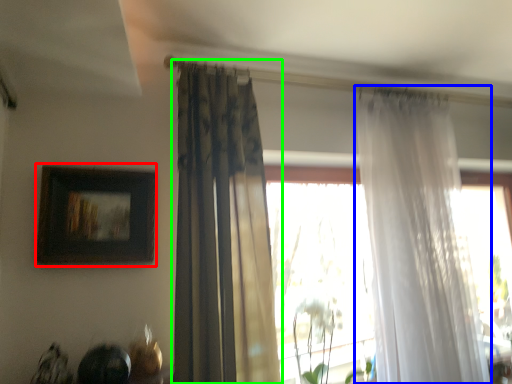
Question: Which object is the closest to the picture frame (highlighted by a red box)? Choose among these: curtain (highlighted by a blue box) or curtain (highlighted by a green box).

Choices:
 (A) curtain
 (B) curtain

Answer: (B)